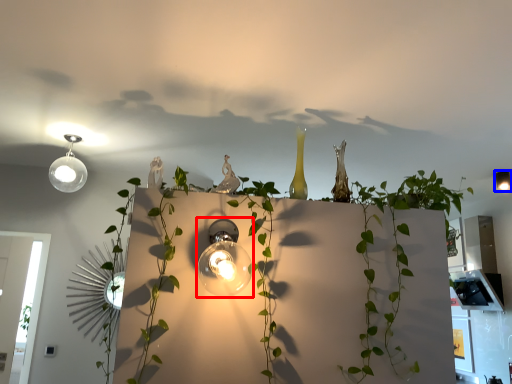
Question: Among these objects, which one is nearest to the camera, lamp (highlighted by a red box) or lamp (highlighted by a blue box)?

Choices:
 (A) lamp
 (B) lamp

Answer: (A)